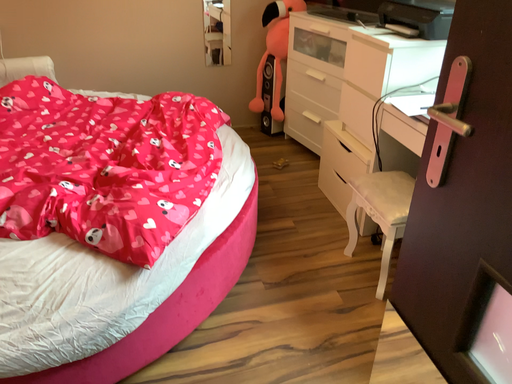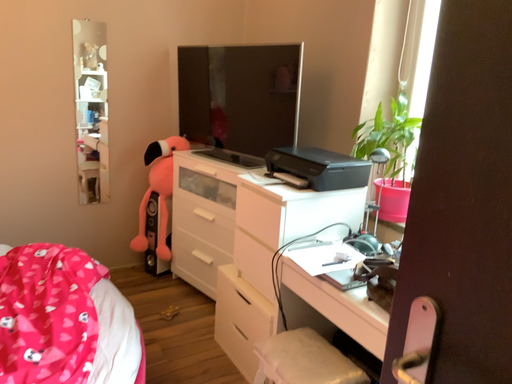
Question: How did the camera likely rotate when shooting the video?

Choices:
 (A) rotated right
 (B) rotated left

Answer: (A)